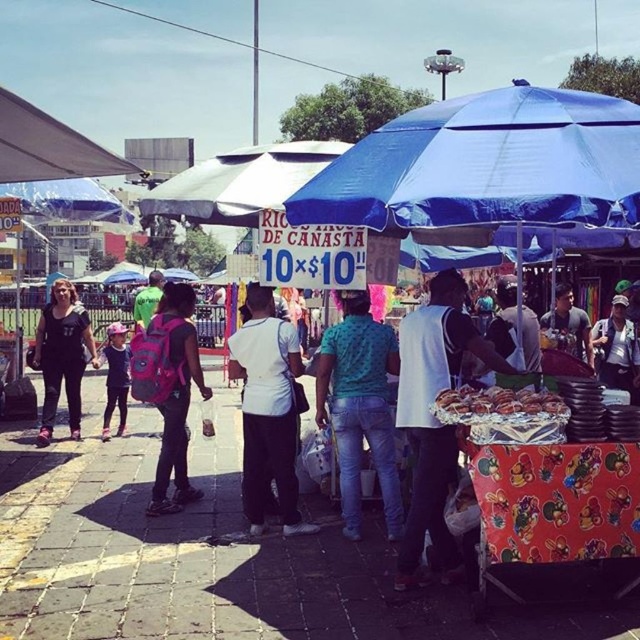
You are a customer standing at the pink backpack at left. You want to buy a snack from the red food cart under the blue fabric umbrella at center. Can you easily reach the cart without moving your backpack?

The blue fabric umbrella at center is shorter than the pink backpack at left, so the backpack might block your view or access to the cart. Consider moving the backpack aside for better access.

You are standing at the entrance of the market and see a point marked at coordinates (x=433, y=417). What object is located at that point?

The point at coordinates (x=433, y=417) corresponds to the printed fabric cart at center.

You are a customer at the market and see the blue fabric umbrella at center and the pink backpack at left. Which object is located to the right side of the other?

The blue fabric umbrella at center is to the right of the pink backpack at left.